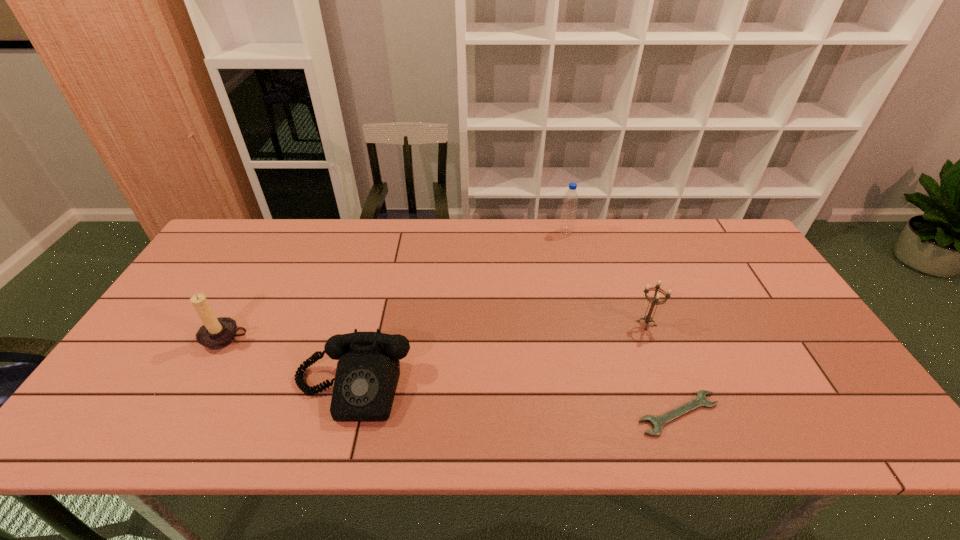
Identify the location of the third object from left to right. This screenshot has height=540, width=960. (569, 207).

Find the location of a particular element. The width and height of the screenshot is (960, 540). water bottle is located at coordinates point(569,207).

Identify the location of the second tallest object. The height and width of the screenshot is (540, 960). (216, 333).

Identify the location of the taller candle holder. (216, 333).

Where is `the shorter candle holder`? The height and width of the screenshot is (540, 960). the shorter candle holder is located at coordinates (655, 301).

Locate an element on the screen. This screenshot has height=540, width=960. the fourth object from right to left is located at coordinates (368, 368).

I want to click on the shortest object, so click(658, 422).

At what (x,y) coordinates should I click in order to perform the action: click on free space located on the right of the third object from right to left. Please return your answer as a coordinate pair (x, y). Image resolution: width=960 pixels, height=540 pixels. Looking at the image, I should click on (x=599, y=232).

The height and width of the screenshot is (540, 960). I want to click on free spot located on the wick of the taller candle holder, so click(177, 429).

This screenshot has width=960, height=540. In order to click on free space located on the left of the right candle holder in this screenshot , I will do `click(572, 323)`.